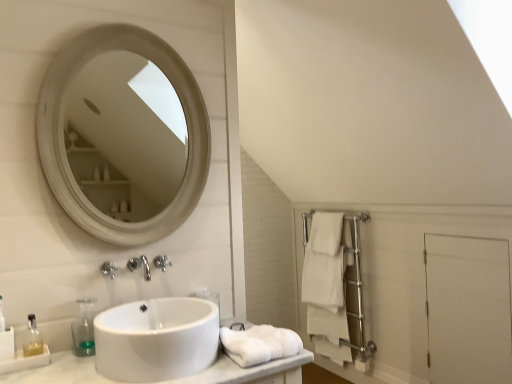
Question: Is translucent plastic soap dispenser at lower left, which appears as the 1th soap dispenser when viewed from the left, touching transparent plastic soap dispenser at lower left, positioned as the first soap dispenser in right-to-left order?

Choices:
 (A) no
 (B) yes

Answer: (A)

Question: Is the depth of translucent plastic soap dispenser at lower left, which appears as the 1th soap dispenser when viewed from the left, less than that of transparent plastic soap dispenser at lower left, the second soap dispenser when ordered from left to right?

Choices:
 (A) no
 (B) yes

Answer: (B)

Question: Is translucent plastic soap dispenser at lower left, the second soap dispenser when ordered from right to left, behind transparent plastic soap dispenser at lower left, the second soap dispenser when ordered from left to right?

Choices:
 (A) yes
 (B) no

Answer: (B)

Question: From a real-world perspective, does translucent plastic soap dispenser at lower left, which appears as the 1th soap dispenser when viewed from the left, stand above transparent plastic soap dispenser at lower left, positioned as the first soap dispenser in right-to-left order?

Choices:
 (A) no
 (B) yes

Answer: (A)

Question: Can you confirm if translucent plastic soap dispenser at lower left, which appears as the 1th soap dispenser when viewed from the left, is positioned to the left of transparent plastic soap dispenser at lower left, positioned as the first soap dispenser in right-to-left order?

Choices:
 (A) yes
 (B) no

Answer: (A)

Question: Which is correct: white matte bath towel at lower center, marked as the second bath towel in a bottom-to-top arrangement, is inside satin nickel faucet at center, which ranks as the 2th faucet in right-to-left order, or outside of it?

Choices:
 (A) outside
 (B) inside

Answer: (A)

Question: From a real-world perspective, is white matte bath towel at lower center, marked as the first bath towel in a left-to-right arrangement, positioned above or below satin nickel faucet at center, which ranks as the 2th faucet in right-to-left order?

Choices:
 (A) above
 (B) below

Answer: (B)

Question: In the image, is white matte bath towel at lower center, the 2th bath towel in the right-to-left sequence, positioned in front of or behind satin nickel faucet at center, placed as the second faucet when sorted from back to front?

Choices:
 (A) front
 (B) behind

Answer: (A)

Question: In terms of height, does white matte bath towel at lower center, marked as the first bath towel in a left-to-right arrangement, look taller or shorter compared to satin nickel faucet at center, placed as the second faucet when sorted from back to front?

Choices:
 (A) tall
 (B) short

Answer: (A)

Question: Is satin nickel faucet at center, which is the 1th faucet in front-to-back order, in front of or behind white cotton towel at right, the first bath towel positioned from the back, in the image?

Choices:
 (A) behind
 (B) front

Answer: (B)

Question: In terms of height, does satin nickel faucet at center, which ranks as the 2th faucet in right-to-left order, look taller or shorter compared to white cotton towel at right, positioned as the 2th bath towel in front-to-back order?

Choices:
 (A) short
 (B) tall

Answer: (A)

Question: Considering the positions of satin nickel faucet at center, which is the 1th faucet in front-to-back order, and white cotton towel at right, the first bath towel from the right, in the image, is satin nickel faucet at center, which is the 1th faucet in front-to-back order, wider or thinner than white cotton towel at right, the first bath towel from the right,?

Choices:
 (A) thin
 (B) wide

Answer: (A)

Question: From the image's perspective, is satin nickel faucet at center, which is the 1th faucet in front-to-back order, positioned above or below white cotton towel at right, which is the first bath towel in bottom-to-top order?

Choices:
 (A) above
 (B) below

Answer: (A)

Question: In terms of height, does white glossy sink at center look taller or shorter compared to translucent plastic soap dispenser at lower left, which appears as the 1th soap dispenser when viewed from the left?

Choices:
 (A) tall
 (B) short

Answer: (A)

Question: Considering the positions of white glossy sink at center and translucent plastic soap dispenser at lower left, which appears as the 1th soap dispenser when viewed from the left, in the image, is white glossy sink at center wider or thinner than translucent plastic soap dispenser at lower left, which appears as the 1th soap dispenser when viewed from the left,?

Choices:
 (A) wide
 (B) thin

Answer: (A)